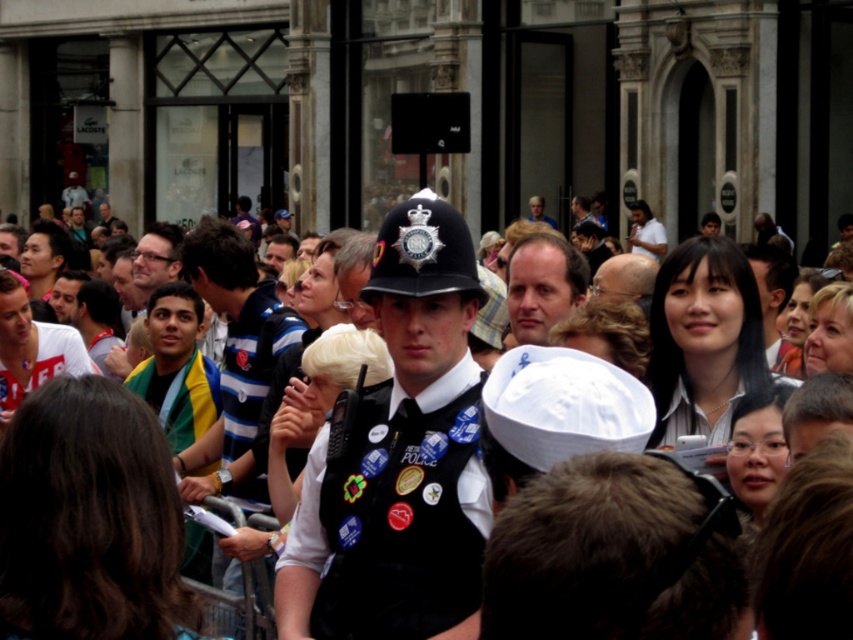
Question: Among these objects, which one is nearest to the camera?

Choices:
 (A) light brown hair at center
 (B) black uniform at center

Answer: (B)

Question: Does black uniform at center lie in front of light brown hair at center?

Choices:
 (A) no
 (B) yes

Answer: (B)

Question: Which point appears closest to the camera in this image?

Choices:
 (A) (444, 630)
 (B) (561, 257)

Answer: (A)

Question: Which point is closer to the camera taking this photo?

Choices:
 (A) 363,291
 (B) 520,244

Answer: (A)

Question: Can you confirm if black uniform at center is thinner than light brown hair at center?

Choices:
 (A) yes
 (B) no

Answer: (B)

Question: Is black uniform at center bigger than light brown hair at center?

Choices:
 (A) yes
 (B) no

Answer: (A)